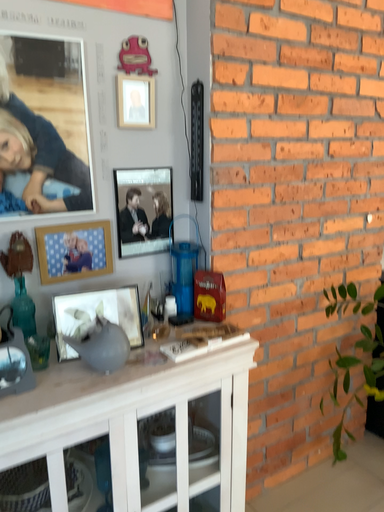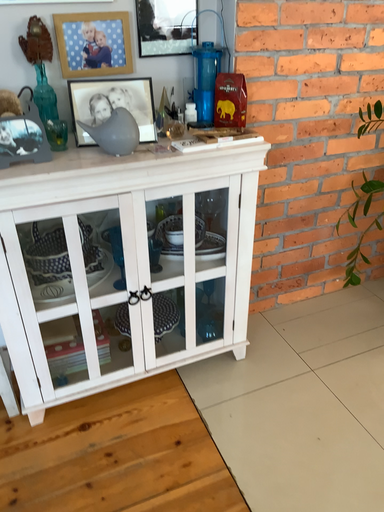
Question: How did the camera likely rotate when shooting the video?

Choices:
 (A) rotated downward
 (B) rotated upward

Answer: (A)